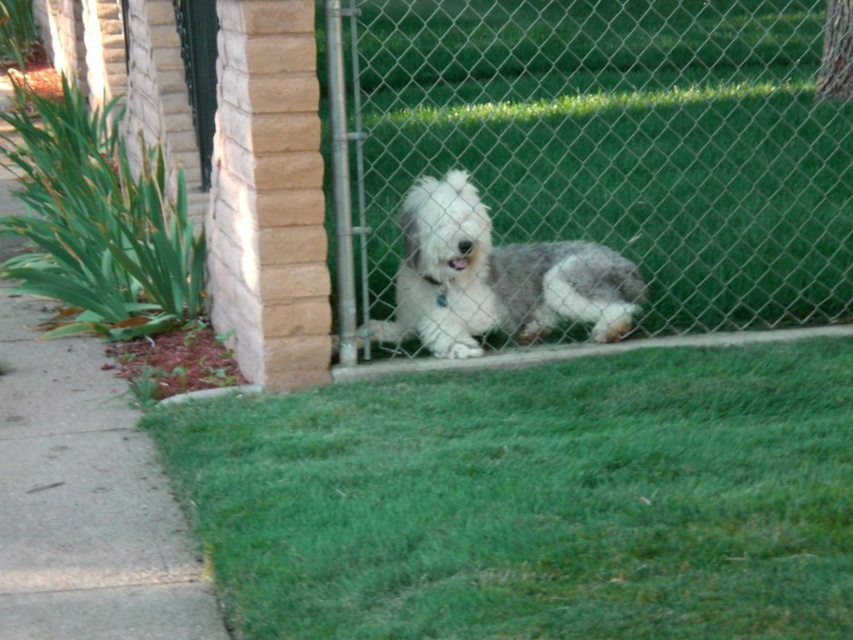
Which of these two, metal chain-link fence at center or white fluffy dog at center, stands taller?

metal chain-link fence at center is taller.

Consider the image. Is metal chain-link fence at center taller than white fluffy dog at center?

Indeed, metal chain-link fence at center has a greater height compared to white fluffy dog at center.

Does point (355, 42) come farther from viewer compared to point (553, 276)?

No, it is in front of (553, 276).

Where is `metal chain-link fence at center`? metal chain-link fence at center is located at coordinates (604, 144).

Which is more to the left, metal chain-link fence at center or green leafy grass at lower left?

From the viewer's perspective, green leafy grass at lower left appears more on the left side.

Is metal chain-link fence at center closer to the viewer compared to green leafy grass at lower left?

Yes, metal chain-link fence at center is in front of green leafy grass at lower left.

What do you see at coordinates (604, 144) in the screenshot?
I see `metal chain-link fence at center` at bounding box center [604, 144].

Where is `metal chain-link fence at center`? This screenshot has width=853, height=640. metal chain-link fence at center is located at coordinates (604, 144).

Who is lower down, green leafy grass at lower left or white fluffy dog at center?

Positioned lower is white fluffy dog at center.

Is green leafy grass at lower left to the right of white fluffy dog at center from the viewer's perspective?

Incorrect, green leafy grass at lower left is not on the right side of white fluffy dog at center.

Between point (120, 188) and point (602, 314), which one is positioned in front?

Positioned in front is point (602, 314).

Find the location of `green leafy grass at lower left`. green leafy grass at lower left is located at coordinates (97, 221).